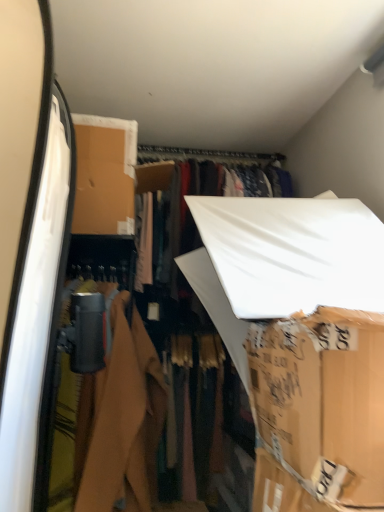
Question: From a real-world perspective, is brown cardboard box at center physically located above or below matte black camera at left?

Choices:
 (A) above
 (B) below

Answer: (A)

Question: Is brown cardboard box at center in front of or behind matte black camera at left in the image?

Choices:
 (A) front
 (B) behind

Answer: (A)

Question: In terms of size, does brown cardboard box at center appear bigger or smaller than matte black camera at left?

Choices:
 (A) big
 (B) small

Answer: (B)

Question: From the image's perspective, is matte black camera at left located above or below brown cardboard box at center?

Choices:
 (A) below
 (B) above

Answer: (A)

Question: Would you say matte black camera at left is inside or outside brown cardboard box at center?

Choices:
 (A) outside
 (B) inside

Answer: (A)

Question: Visually, is matte black camera at left positioned to the left or to the right of brown cardboard box at center?

Choices:
 (A) right
 (B) left

Answer: (B)

Question: In the image, is matte black camera at left positioned in front of or behind brown cardboard box at center?

Choices:
 (A) behind
 (B) front

Answer: (A)